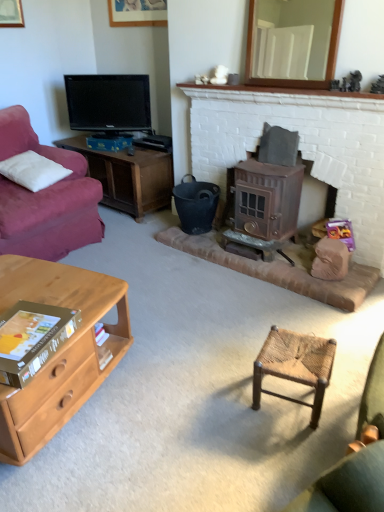
Question: Is light brown wood desk at lower left bigger or smaller than woven wood stool at center?

Choices:
 (A) small
 (B) big

Answer: (B)

Question: From the image's perspective, is light brown wood desk at lower left above or below woven wood stool at center?

Choices:
 (A) below
 (B) above

Answer: (B)

Question: Which object is positioned closest to the white brick fireplace at upper center?

Choices:
 (A) white wooden mirror at upper center
 (B) bronze metallic wood burning stove at center-right
 (C) black matte bucket at center
 (D) black glossy tv at upper left
 (E) wooden picture frame at upper center

Answer: (A)

Question: Considering the real-world distances, which object is closest to the bronze metallic wood burning stove at center-right?

Choices:
 (A) black matte bucket at center
 (B) light brown wood desk at lower left
 (C) wooden picture frame at upper center
 (D) blue cardboard box at left
 (E) gold cardboard book at lower left

Answer: (A)